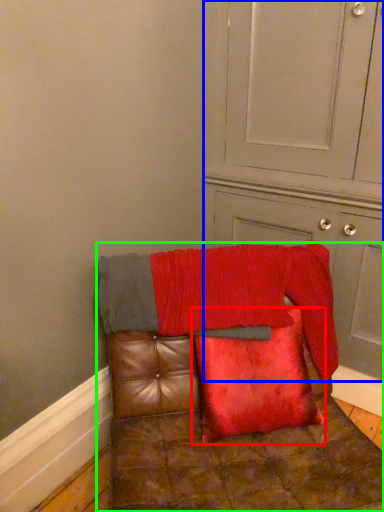
Question: Estimate the real-world distances between objects in this image. Which object is farther from pillow (highlighted by a red box), dresser (highlighted by a blue box) or furniture (highlighted by a green box)?

Choices:
 (A) dresser
 (B) furniture

Answer: (A)